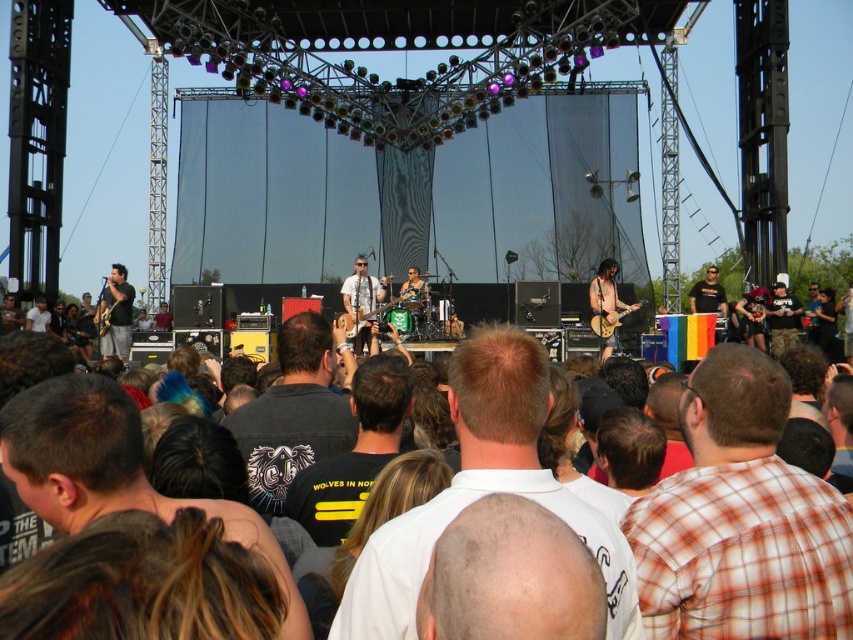
You are a photographer standing at the front of the stage during the concert. You want to take a photo that includes both point (496, 572) and point (596, 285). Since you have a limited depth of field, which point should you focus on to ensure the closer one is sharp?

You should focus on point (496, 572) because it is closer to the camera than point (596, 285), ensuring it remains sharp with the limited depth of field.